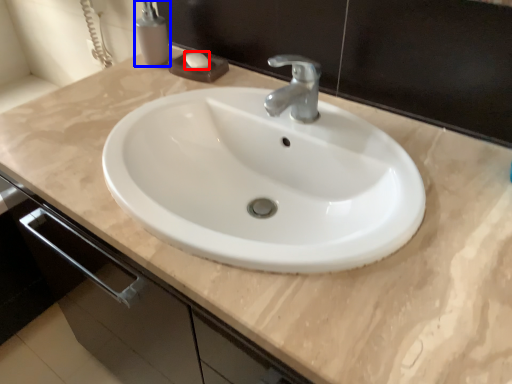
Question: Which of the following is the farthest to the observer, soap (highlighted by a red box) or soap dispenser (highlighted by a blue box)?

Choices:
 (A) soap
 (B) soap dispenser

Answer: (A)